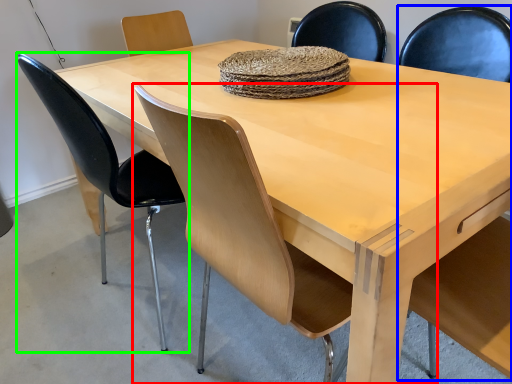
Question: Considering the real-world distances, which object is farthest from chair (highlighted by a red box)? armchair (highlighted by a blue box) or chair (highlighted by a green box)?

Choices:
 (A) armchair
 (B) chair

Answer: (A)